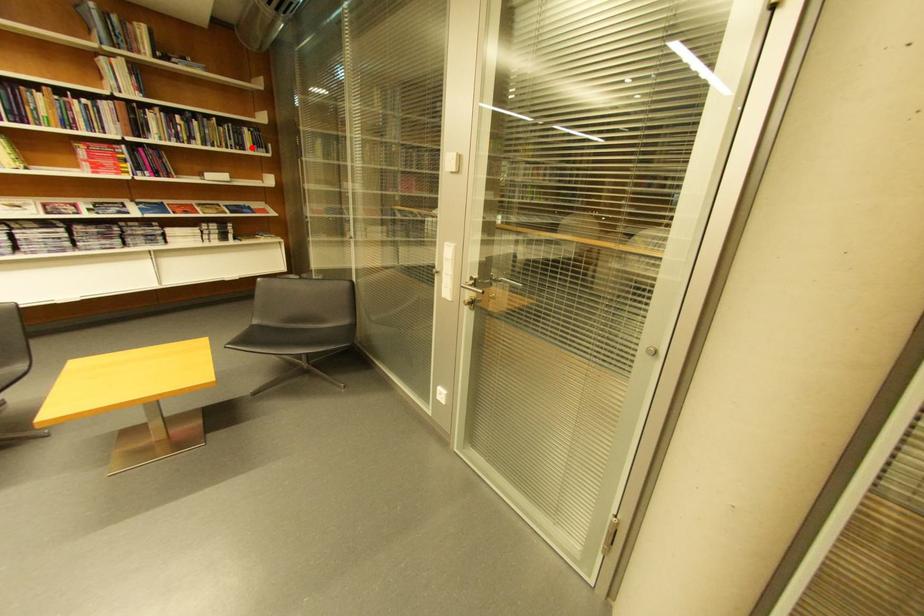
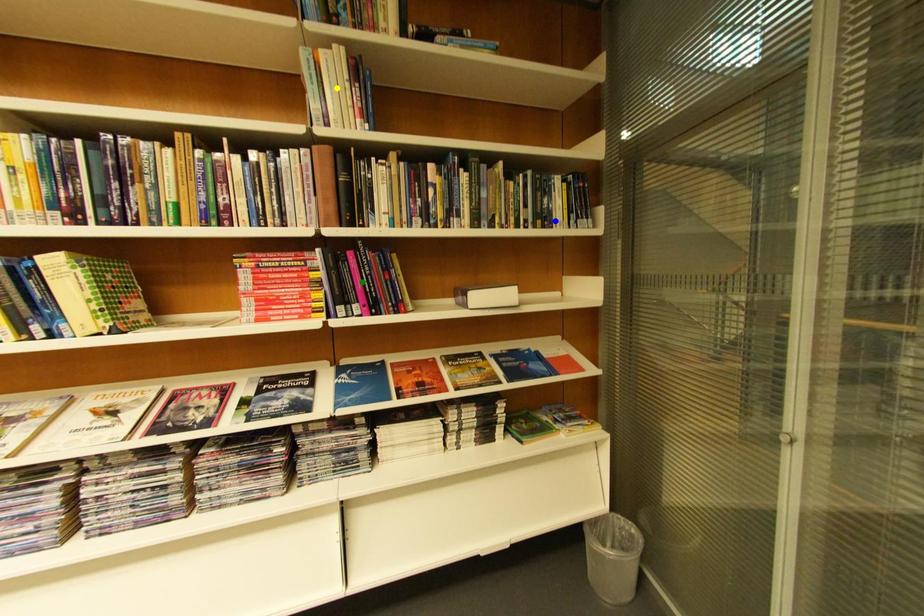
Question: I am providing you with two images of the same scene from different viewpoints. A red point is marked on the first image. You are given multiple points on the second image. Which point in image 2 is actually the same real-world point as the red point in image 1?

Choices:
 (A) green point
 (B) yellow point
 (C) blue point

Answer: (C)